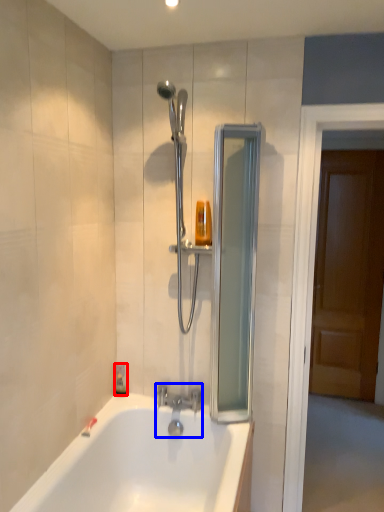
Question: Which point is further to the camera, soap dispenser (highlighted by a red box) or tap (highlighted by a blue box)?

Choices:
 (A) soap dispenser
 (B) tap

Answer: (A)